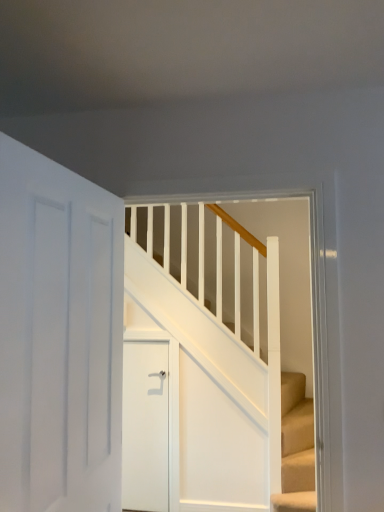
Question: From a real-world perspective, is white matte door at center, the first door from the back, positioned under white wooden stairs at center based on gravity?

Choices:
 (A) no
 (B) yes

Answer: (B)

Question: Are white matte door at center, positioned as the second door in front-to-back order, and white wooden stairs at center far apart?

Choices:
 (A) yes
 (B) no

Answer: (B)

Question: Is white matte door at center, positioned as the second door in front-to-back order, positioned beyond the bounds of white wooden stairs at center?

Choices:
 (A) no
 (B) yes

Answer: (B)

Question: Considering the relative sizes of white matte door at center, the first door from the back, and white wooden stairs at center in the image provided, is white matte door at center, the first door from the back, smaller than white wooden stairs at center?

Choices:
 (A) yes
 (B) no

Answer: (A)

Question: Considering the relative sizes of white matte door at center, positioned as the second door in front-to-back order, and white wooden stairs at center in the image provided, is white matte door at center, positioned as the second door in front-to-back order, wider than white wooden stairs at center?

Choices:
 (A) no
 (B) yes

Answer: (A)

Question: Is point (49, 372) positioned closer to the camera than point (152, 390)?

Choices:
 (A) farther
 (B) closer

Answer: (B)

Question: Is white matte door at left, the 1th door positioned from the front, wider or thinner than white matte door at center, positioned as the second door in front-to-back order?

Choices:
 (A) wide
 (B) thin

Answer: (B)

Question: In the image, is white matte door at left, which appears as the second door when viewed from the back, positioned in front of or behind white matte door at center, positioned as the second door in front-to-back order?

Choices:
 (A) front
 (B) behind

Answer: (A)

Question: Is white matte door at left, the 1th door positioned from the front, spatially inside white matte door at center, the first door from the back, or outside of it?

Choices:
 (A) outside
 (B) inside

Answer: (A)

Question: Is white matte door at center, the first door from the back, wider or thinner than white wooden stairs at center?

Choices:
 (A) wide
 (B) thin

Answer: (B)

Question: From a real-world perspective, relative to white wooden stairs at center, is white matte door at center, positioned as the second door in front-to-back order, vertically above or below?

Choices:
 (A) below
 (B) above

Answer: (A)

Question: Does point coord(144,356) appear closer or farther from the camera than point coord(276,276)?

Choices:
 (A) closer
 (B) farther

Answer: (B)

Question: Based on their positions, is white matte door at center, positioned as the second door in front-to-back order, located to the left or right of white wooden stairs at center?

Choices:
 (A) right
 (B) left

Answer: (B)

Question: Is point (269, 467) positioned closer to the camera than point (167, 508)?

Choices:
 (A) farther
 (B) closer

Answer: (B)

Question: Choose the correct answer: Is white wooden stairs at center inside white matte door at center, the first door from the back, or outside it?

Choices:
 (A) outside
 (B) inside

Answer: (A)